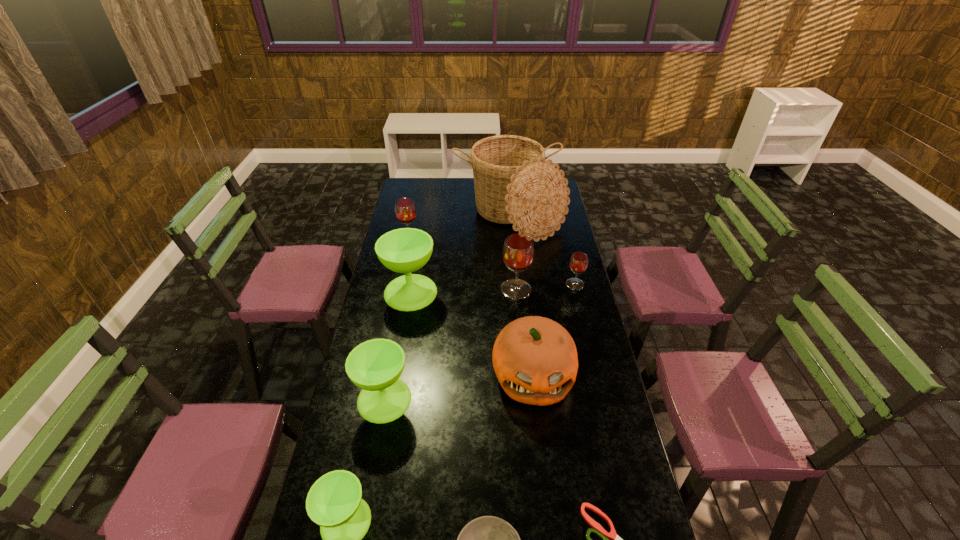
The image size is (960, 540). Identify the location of the smallest red wineglass. (578, 263).

Where is `blank space located on the back of the tallest object`? The image size is (960, 540). blank space located on the back of the tallest object is located at coordinates (507, 185).

Locate an element on the screen. free space located 0.360m on the left of the second red wineglass from left to right is located at coordinates 417,289.

In order to click on free point located 0.340m on the back of the biggest green wineglass in this screenshot , I will do `click(421, 231)`.

Identify the location of vacant space located 0.320m on the face of the pumpkin. (547, 516).

This screenshot has width=960, height=540. In order to click on free spot located 0.290m on the front of the farthest wineglass in this screenshot , I will do `click(399, 285)`.

The height and width of the screenshot is (540, 960). What are the coordinates of `free point located on the back of the fifth farthest wineglass` in the screenshot? It's located at (397, 333).

Find the location of a particular element. The width and height of the screenshot is (960, 540). blank area located 0.190m on the front of the rightmost wineglass is located at coordinates (585, 323).

Where is `object at the far edge`? object at the far edge is located at coordinates (514, 184).

Where is `basket that is at the right edge`? The height and width of the screenshot is (540, 960). basket that is at the right edge is located at coordinates (514, 184).